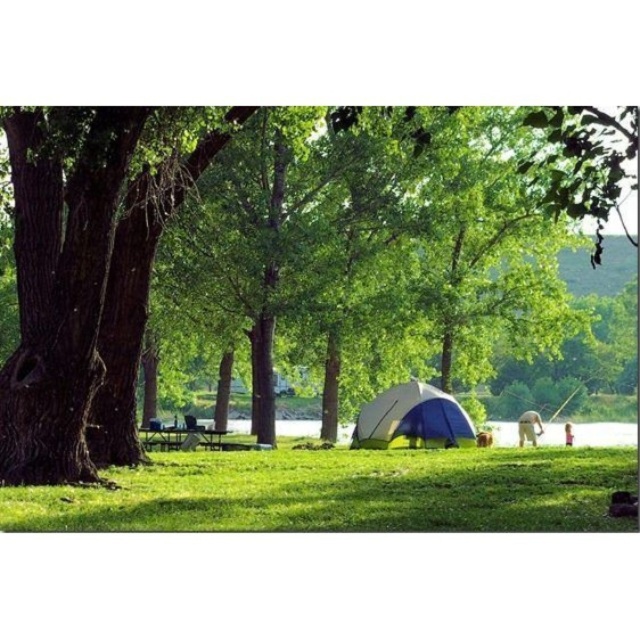
Question: In this image, where is green leafy tree at center located relative to white/blue fabric tent at center?

Choices:
 (A) above
 (B) below

Answer: (A)

Question: Among these points, which one is farthest from the camera?

Choices:
 (A) (396, 401)
 (B) (60, 420)

Answer: (A)

Question: Is dark brown bark tree at left positioned behind green grass at lower center?

Choices:
 (A) no
 (B) yes

Answer: (B)

Question: Which object is the closest to the white/blue fabric tent at center?

Choices:
 (A) green matte picnic table at center
 (B) green leafy tree at center

Answer: (A)

Question: Is green leafy tree at center above white/blue fabric tent at center?

Choices:
 (A) yes
 (B) no

Answer: (A)

Question: Which of these objects is positioned closest to the green leafy tree at center?

Choices:
 (A) dark brown bark tree at left
 (B) green matte picnic table at center
 (C) white/blue fabric tent at center
 (D) green grass at lower center

Answer: (D)